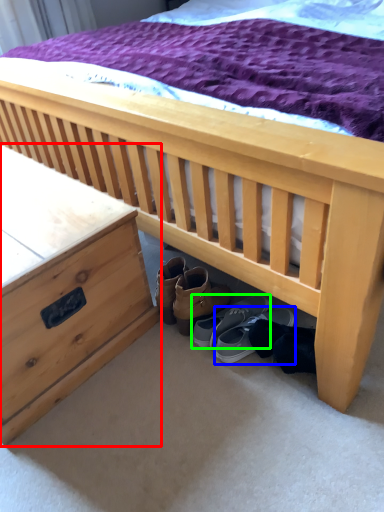
Question: Which is nearer to the nightstand (highlighted by a red box)? footwear (highlighted by a blue box) or footwear (highlighted by a green box).

Choices:
 (A) footwear
 (B) footwear

Answer: (B)